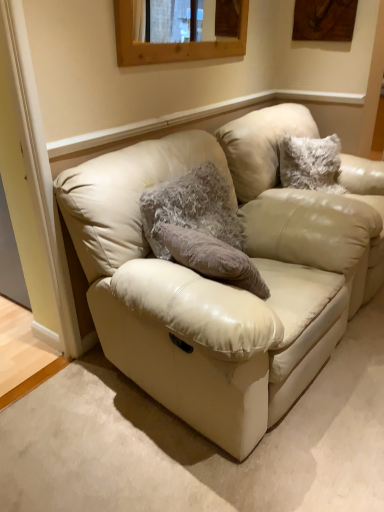
Question: Does beige leather swivel chair at center contain beige leather couch at center?

Choices:
 (A) no
 (B) yes

Answer: (A)

Question: Does beige leather swivel chair at center have a greater height compared to beige leather couch at center?

Choices:
 (A) no
 (B) yes

Answer: (B)

Question: Is beige leather couch at center at the back of beige leather swivel chair at center?

Choices:
 (A) yes
 (B) no

Answer: (B)

Question: Considering the relative sizes of beige leather swivel chair at center and beige leather couch at center in the image provided, is beige leather swivel chair at center wider than beige leather couch at center?

Choices:
 (A) yes
 (B) no

Answer: (B)

Question: From the image's perspective, is beige leather swivel chair at center on beige leather couch at center?

Choices:
 (A) yes
 (B) no

Answer: (A)

Question: Looking at the image, does beige leather swivel chair at center seem bigger or smaller compared to fuzzy gray pillow at center?

Choices:
 (A) small
 (B) big

Answer: (B)

Question: Is beige leather swivel chair at center situated inside fuzzy gray pillow at center or outside?

Choices:
 (A) inside
 (B) outside

Answer: (B)

Question: From their relative heights in the image, would you say beige leather swivel chair at center is taller or shorter than fuzzy gray pillow at center?

Choices:
 (A) short
 (B) tall

Answer: (B)

Question: From the image's perspective, is beige leather swivel chair at center above or below fuzzy gray pillow at center?

Choices:
 (A) below
 (B) above

Answer: (B)

Question: Considering the positions of point (135, 57) and point (129, 342), is point (135, 57) closer or farther from the camera than point (129, 342)?

Choices:
 (A) closer
 (B) farther

Answer: (B)

Question: Is wooden frame at upper center wider or thinner than beige leather couch at center?

Choices:
 (A) thin
 (B) wide

Answer: (A)

Question: Choose the correct answer: Is wooden frame at upper center inside beige leather couch at center or outside it?

Choices:
 (A) outside
 (B) inside

Answer: (A)

Question: Considering their positions, is wooden frame at upper center located in front of or behind beige leather couch at center?

Choices:
 (A) front
 (B) behind

Answer: (B)

Question: Looking at their shapes, would you say beige leather swivel chair at center is wider or thinner than wooden frame at upper center?

Choices:
 (A) wide
 (B) thin

Answer: (A)

Question: Looking at the image, does beige leather swivel chair at center seem bigger or smaller compared to wooden frame at upper center?

Choices:
 (A) big
 (B) small

Answer: (A)